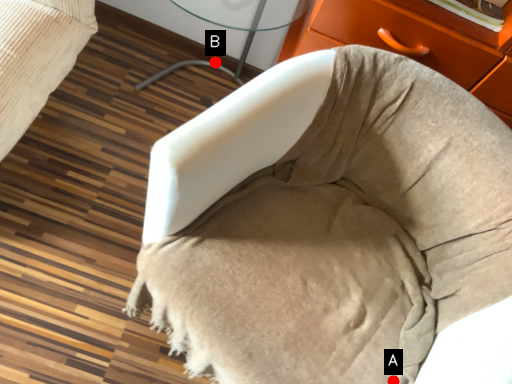
Question: Two points are circled on the image, labeled by A and B beside each circle. Which point is closer to the camera taking this photo?

Choices:
 (A) A is closer
 (B) B is closer

Answer: (A)